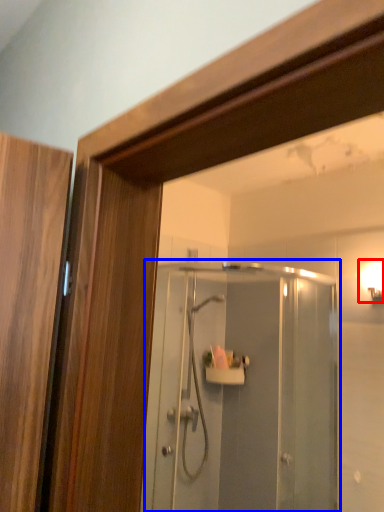
Question: Which of the following is the closest to the observer, light fixture (highlighted by a red box) or screen door (highlighted by a blue box)?

Choices:
 (A) light fixture
 (B) screen door

Answer: (B)